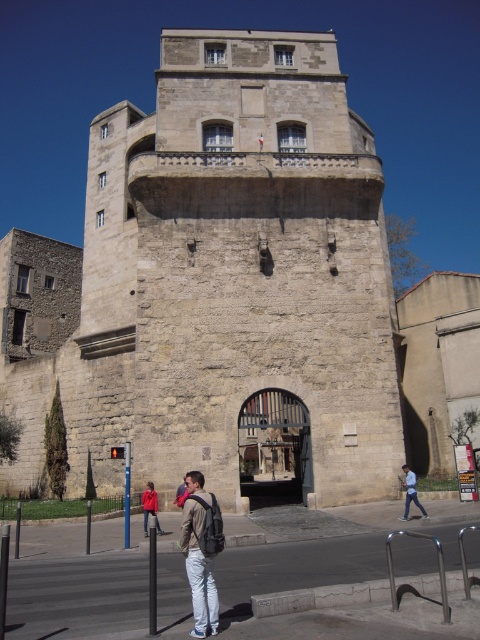
Can you confirm if stone tower at center is positioned above light brown backpack at center?

Yes.

Is stone tower at center positioned before light brown backpack at center?

That is False.

Find the location of a particular element. stone tower at center is located at coordinates (228, 282).

Does stone tower at center have a lesser height compared to light blue jeans at lower right?

Incorrect, stone tower at center's height does not fall short of light blue jeans at lower right's.

Consider the image. Measure the distance between point (x=82, y=433) and camera.

They are 61.71 meters apart.

Does point (80, 422) come farther from viewer compared to point (405, 481)?

Yes, point (80, 422) is farther from viewer.

Where is `stone tower at center`? stone tower at center is located at coordinates (228, 282).

Which is more to the left, stone tower at center or red fabric jacket at center?

red fabric jacket at center

This screenshot has width=480, height=640. What do you see at coordinates (228, 282) in the screenshot?
I see `stone tower at center` at bounding box center [228, 282].

Between point (120, 401) and point (146, 486), which one is positioned behind?

The point (120, 401) is behind.

The width and height of the screenshot is (480, 640). What are the coordinates of `stone tower at center` in the screenshot? It's located at (228, 282).